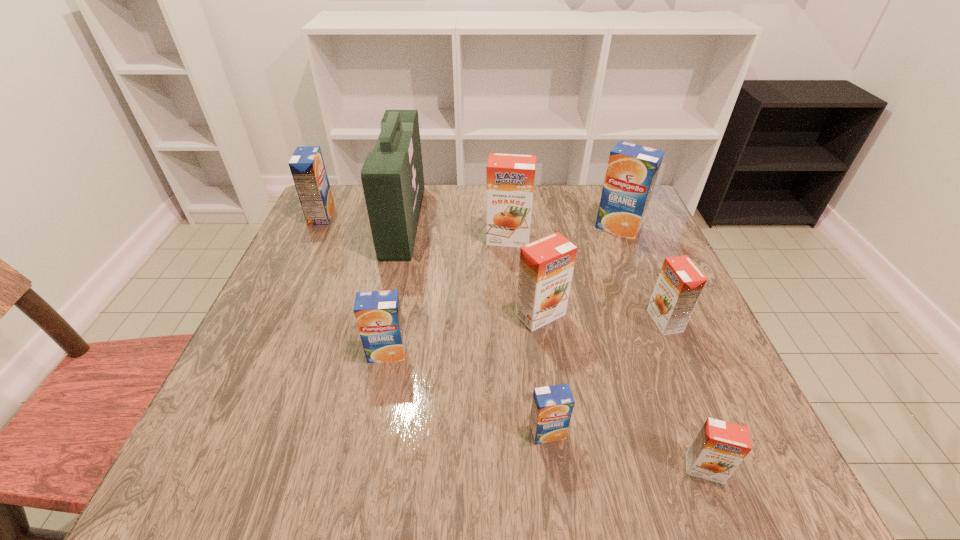
Find the location of a particular element. vacant space that is in between the second smallest orange orange juice and the nearest orange orange juice is located at coordinates (684, 395).

Locate an element on the screen. The width and height of the screenshot is (960, 540). blank region between the nearest object and the biggest orange orange juice is located at coordinates (606, 354).

Locate an element on the screen. The width and height of the screenshot is (960, 540). empty space between the biggest blue orange_juice and the second biggest orange orange juice is located at coordinates (580, 271).

What are the coordinates of `free space between the second smallest orange orange juice and the third smallest orange orange juice` in the screenshot? It's located at (603, 318).

Where is `free space between the second smallest orange orange juice and the smallest blue orange_juice`? The height and width of the screenshot is (540, 960). free space between the second smallest orange orange juice and the smallest blue orange_juice is located at coordinates (606, 377).

Find the location of `blank region between the leftmost orange juice and the biggest blue orange_juice`. blank region between the leftmost orange juice and the biggest blue orange_juice is located at coordinates (470, 221).

The width and height of the screenshot is (960, 540). In order to click on empty space that is in between the nearest blue orange_juice and the third biggest orange orange juice in this screenshot , I will do `click(606, 377)`.

I want to click on free space between the second biggest blue orange_juice and the smallest orange orange juice, so pyautogui.click(x=513, y=342).

Locate an element on the screen. Image resolution: width=960 pixels, height=540 pixels. unoccupied area between the smallest blue orange_juice and the farthest orange orange juice is located at coordinates (527, 335).

Identify the location of object identified as the seventh closest to the farthest orange orange juice. (552, 406).